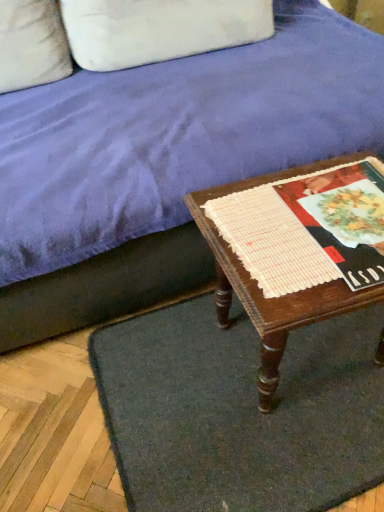
This screenshot has height=512, width=384. Find the location of `vacant space that is to the left of wooden table at lower right`. vacant space that is to the left of wooden table at lower right is located at coordinates (163, 383).